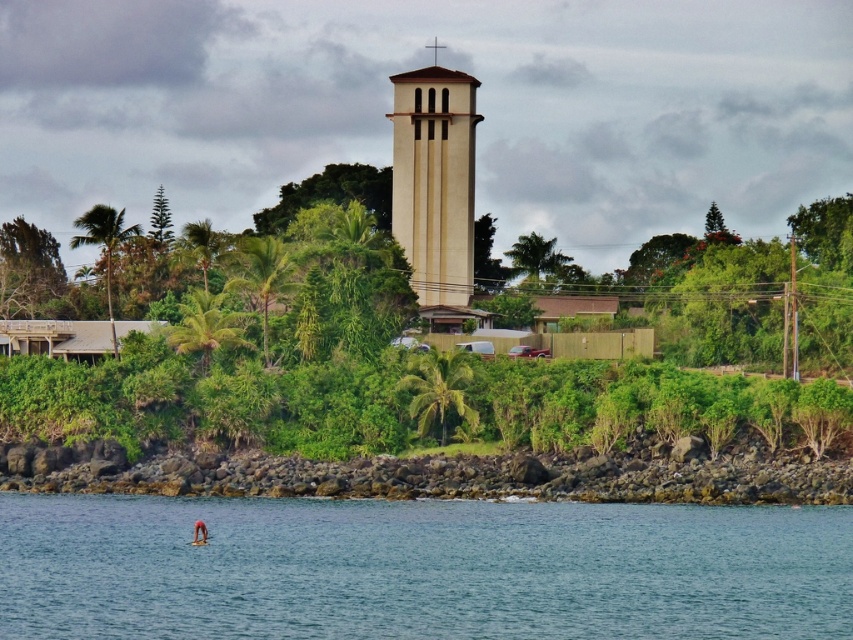
Question: Which of the following is the closest to the observer?

Choices:
 (A) (839, 461)
 (B) (413, 192)

Answer: (A)

Question: Is green leafy shrubs at center below rocky shore at lower left?

Choices:
 (A) no
 (B) yes

Answer: (A)

Question: Which object is closer to the camera taking this photo?

Choices:
 (A) clear blue water at lower center
 (B) rocky shore at lower left

Answer: (A)

Question: Does clear blue water at lower center have a larger size compared to beige concrete bell tower at center?

Choices:
 (A) yes
 (B) no

Answer: (B)

Question: Which point is farther to the camera?

Choices:
 (A) (74, 477)
 (B) (204, 628)
 (C) (440, 230)
 (D) (204, 394)

Answer: (C)

Question: Can you confirm if clear blue water at lower center is smaller than beige concrete bell tower at center?

Choices:
 (A) yes
 (B) no

Answer: (A)